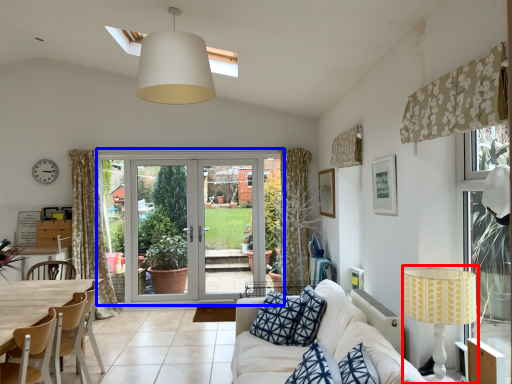
Question: Which point is further to the camera, table lamp (highlighted by a red box) or door (highlighted by a blue box)?

Choices:
 (A) table lamp
 (B) door

Answer: (B)